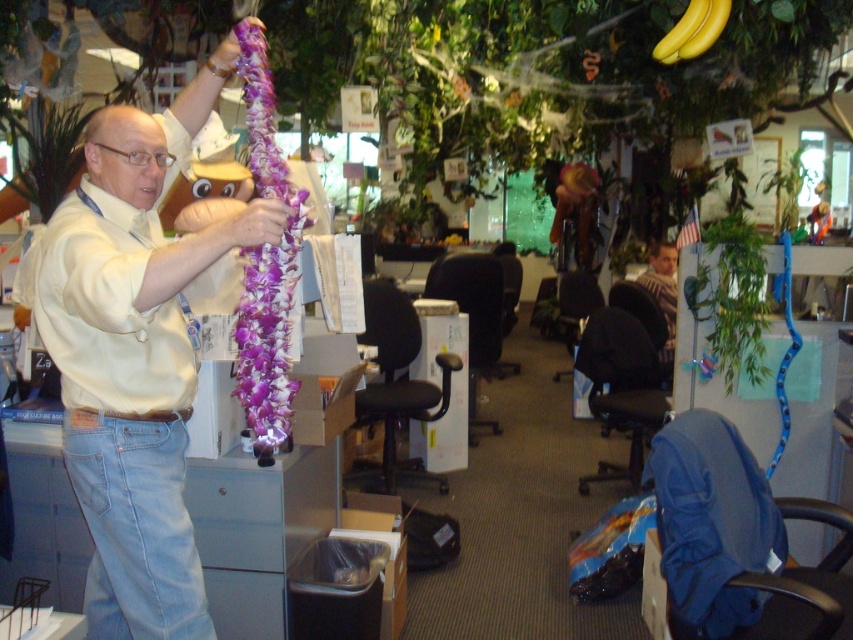
Question: Does matte white shirt at left appear on the left side of light blue denim jeans at lower left?

Choices:
 (A) yes
 (B) no

Answer: (B)

Question: Among these points, which one is farthest from the camera?

Choices:
 (A) (660, 291)
 (B) (726, 0)
 (C) (146, 340)
 (D) (106, 413)

Answer: (A)

Question: Which of the following is the farthest from the observer?

Choices:
 (A) striped sweater at center
 (B) matte white shirt at left
 (C) light blue denim jeans at lower left
 (D) yellow smooth bananas at upper center

Answer: (A)

Question: Which object is positioned farthest from the matte white shirt at left?

Choices:
 (A) light blue denim jeans at lower left
 (B) striped sweater at center

Answer: (B)

Question: Does light blue denim jeans at lower left come behind striped sweater at center?

Choices:
 (A) no
 (B) yes

Answer: (A)

Question: Does matte white shirt at left appear under striped sweater at center?

Choices:
 (A) yes
 (B) no

Answer: (A)